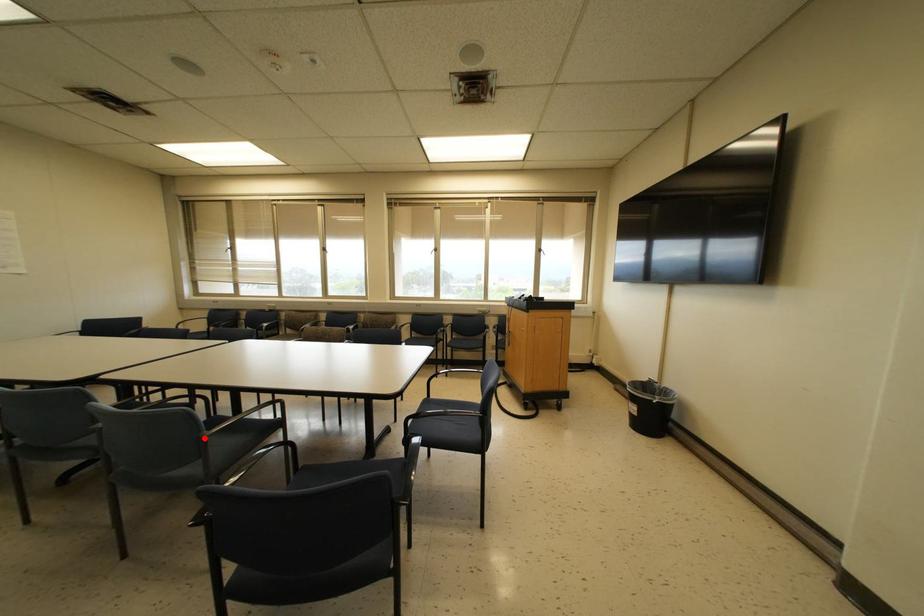
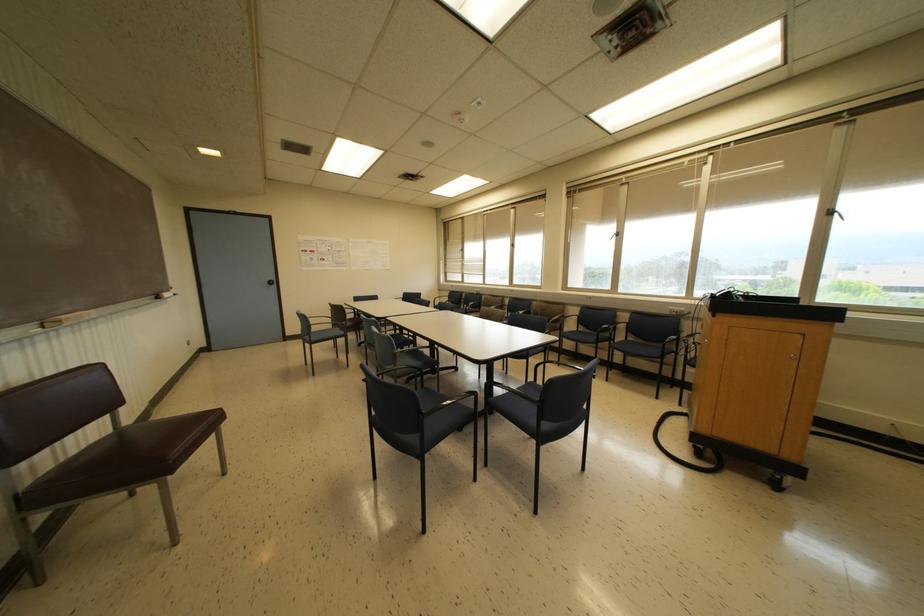
Locate, in the second image, the point that corresponds to the highlighted location in the first image.

(394, 354)